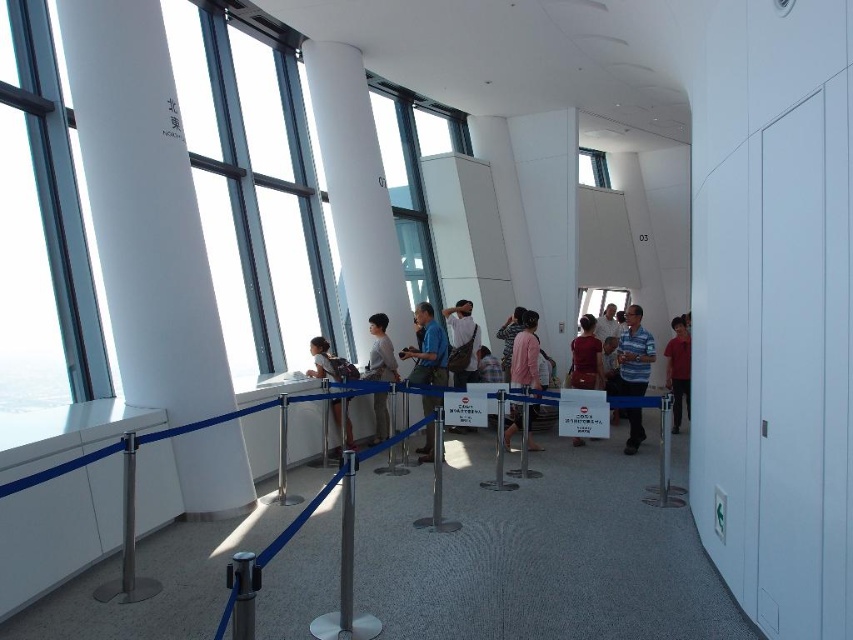
Does white glossy counter at left come in front of matte brown bag at center?

That is True.

Does white glossy counter at left have a smaller size compared to matte brown bag at center?

No.

Find the location of a particular element. The image size is (853, 640). white glossy counter at left is located at coordinates tap(57, 468).

This screenshot has height=640, width=853. In order to click on white glossy counter at left in this screenshot , I will do `click(57, 468)`.

Is point (229, 458) positioned before point (630, 358)?

Yes, it is.

Does white smooth pillar at left appear over blue striped shirt at center?

Yes, white smooth pillar at left is above blue striped shirt at center.

Is point (138, 4) closer to viewer compared to point (630, 424)?

Yes, point (138, 4) is closer to viewer.

You are a GUI agent. You are given a task and a screenshot of the screen. Output one action in this format:
    pyautogui.click(x=<x>, y=<y>)
    Task: Click on the white smooth pillar at left
    
    Given the screenshot: What is the action you would take?
    pyautogui.click(x=144, y=209)

Is point (219, 634) farther from viewer compared to point (589, 340)?

No.

Can you confirm if silver metallic barrier at center is positioned to the left of matte red shirt at center?

Indeed, silver metallic barrier at center is positioned on the left side of matte red shirt at center.

Is point (436, 413) closer to viewer compared to point (581, 387)?

That is True.

Find the location of `silver metallic barrier at center`. silver metallic barrier at center is located at coordinates (296, 522).